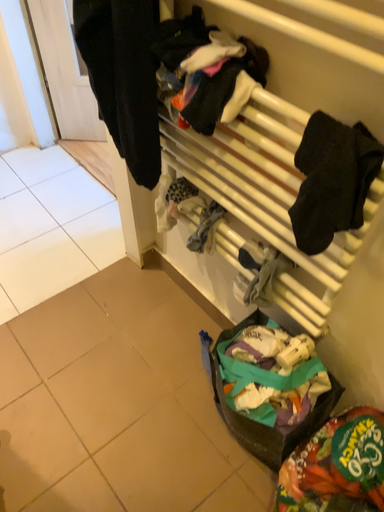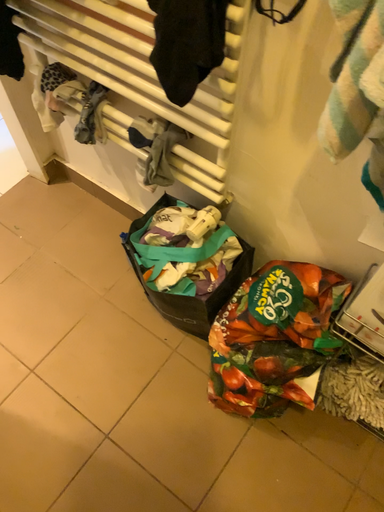
Question: Which way did the camera rotate in the video?

Choices:
 (A) rotated downward
 (B) rotated upward

Answer: (A)